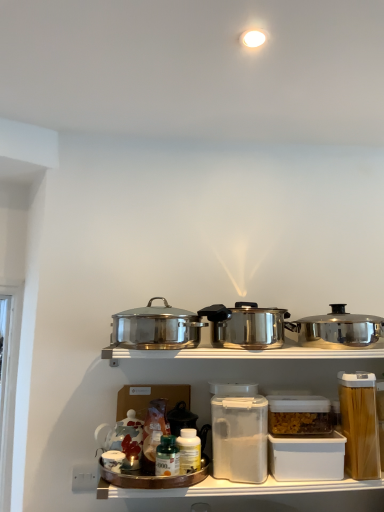
Where is `vacant region below translucent plastic container at center, which ranks as the 3th appliance in right-to-left order (from a real-world perspective)`? This screenshot has width=384, height=512. vacant region below translucent plastic container at center, which ranks as the 3th appliance in right-to-left order (from a real-world perspective) is located at coordinates (239, 483).